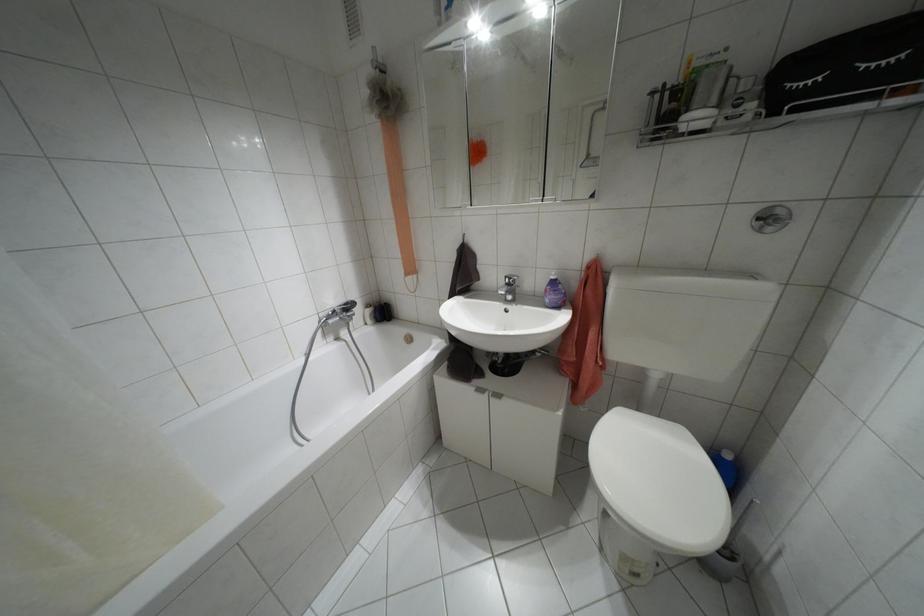
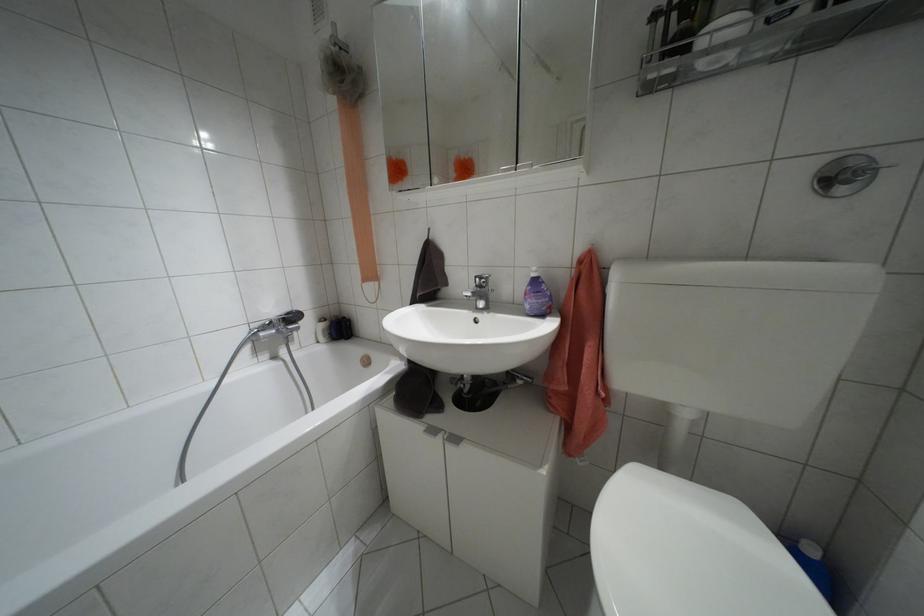
Where in the second image is the point corresponding to point (507, 284) from the first image?

(479, 286)